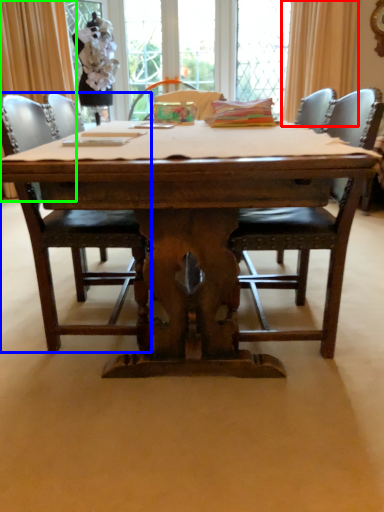
Question: Which object is the closest to the curtain (highlighted by a red box)? Choose among these: chair (highlighted by a blue box) or curtain (highlighted by a green box).

Choices:
 (A) chair
 (B) curtain

Answer: (B)